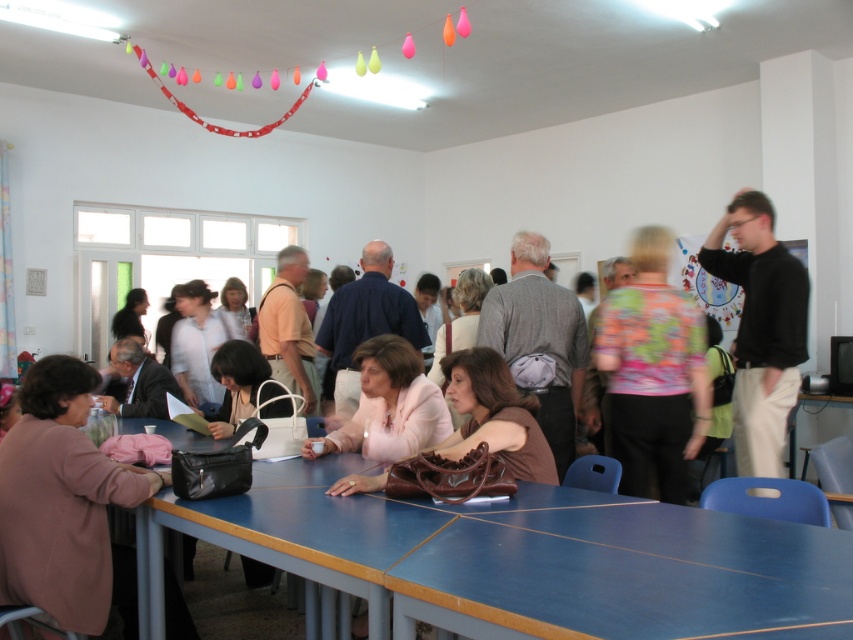
Question: Does pink fabric purse at lower left have a lesser width compared to black cotton shirt at right?

Choices:
 (A) no
 (B) yes

Answer: (A)

Question: Is blue wooden table at lower center smaller than pink fabric purse at lower left?

Choices:
 (A) yes
 (B) no

Answer: (A)

Question: Which point appears farthest from the camera in this image?

Choices:
 (A) (775, 355)
 (B) (727, 572)
 (C) (677, 301)

Answer: (C)

Question: Is blue wooden table at lower center bigger than black cotton shirt at right?

Choices:
 (A) yes
 (B) no

Answer: (B)

Question: Which point is farther to the camera?

Choices:
 (A) (692, 588)
 (B) (635, 285)

Answer: (B)

Question: Which of the following is the farthest from the observer?

Choices:
 (A) (90, 394)
 (B) (798, 284)
 (C) (614, 419)

Answer: (C)